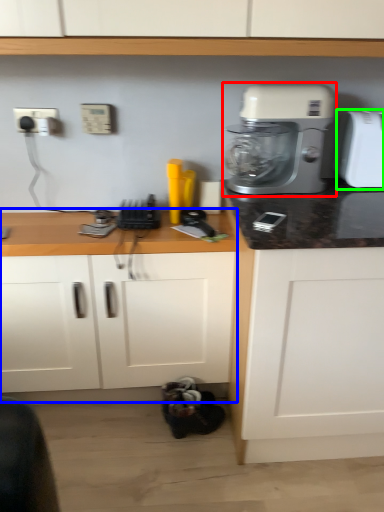
Question: Which is nearer to the mixer (highlighted by a red box)? counter (highlighted by a blue box) or toaster (highlighted by a green box).

Choices:
 (A) counter
 (B) toaster

Answer: (B)